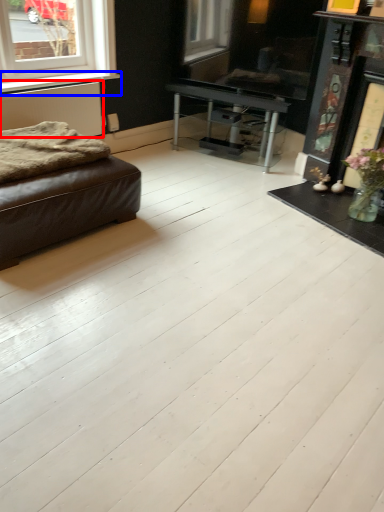
Question: Which point is further to the camera, radiator (highlighted by a red box) or window sill (highlighted by a blue box)?

Choices:
 (A) radiator
 (B) window sill

Answer: (B)